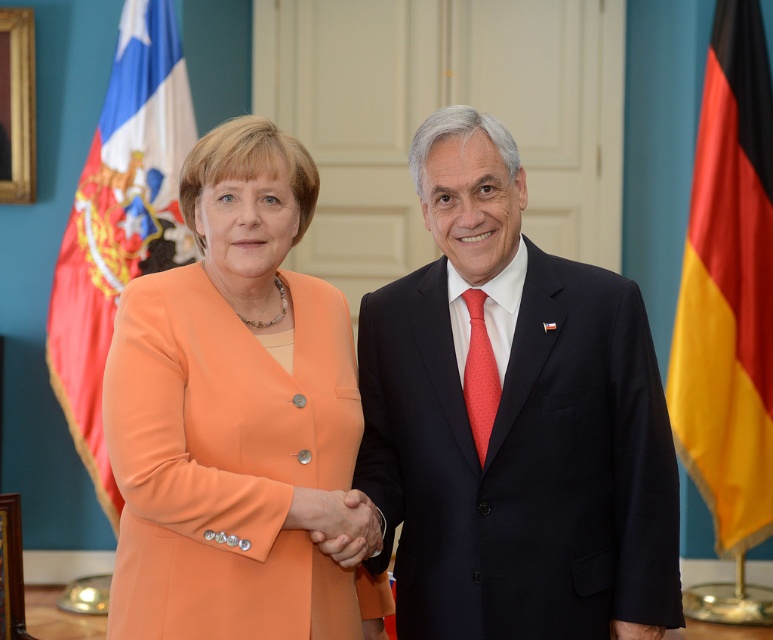
How distant is orange fabric dress at center from yellow fabric flag at right?

orange fabric dress at center and yellow fabric flag at right are 3.39 meters apart from each other.

The image size is (773, 640). Describe the element at coordinates (233, 413) in the screenshot. I see `orange fabric dress at center` at that location.

Where is `orange fabric dress at center`? This screenshot has width=773, height=640. orange fabric dress at center is located at coordinates (233, 413).

Does smooth skin handshake at center have a lesser width compared to red dotted tie at center?

No.

How far apart are smooth skin handshake at center and red dotted tie at center?

smooth skin handshake at center and red dotted tie at center are 39.42 centimeters apart from each other.

Between point (348, 520) and point (472, 388), which one is positioned behind?

The point (472, 388) is behind.

Where is `smooth skin handshake at center`? smooth skin handshake at center is located at coordinates (342, 524).

Which is below, matte black suit at center or smooth skin handshake at center?

Positioned lower is smooth skin handshake at center.

Locate an element on the screen. The image size is (773, 640). matte black suit at center is located at coordinates (513, 420).